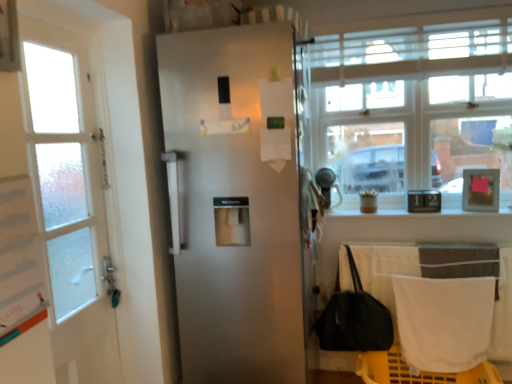
The image size is (512, 384). Describe the element at coordinates (354, 319) in the screenshot. I see `black fabric handbag at lower right` at that location.

What do you see at coordinates (236, 202) in the screenshot?
I see `satin white refrigerator at center` at bounding box center [236, 202].

The image size is (512, 384). Describe the element at coordinates (415, 102) in the screenshot. I see `clear glass window at upper right` at that location.

This screenshot has height=384, width=512. In order to click on white fabric towel at lower right in this screenshot , I will do `click(444, 321)`.

Can you confirm if black fabric handbag at lower right is thinner than satin white refrigerator at center?

Correct, the width of black fabric handbag at lower right is less than that of satin white refrigerator at center.

Between black fabric handbag at lower right and satin white refrigerator at center, which one appears on the left side from the viewer's perspective?

satin white refrigerator at center is more to the left.

From the image's perspective, between black fabric handbag at lower right and satin white refrigerator at center, who is located below?

From the image's view, black fabric handbag at lower right is below.

Between black fabric handbag at lower right and satin white refrigerator at center, which one is positioned in front?

satin white refrigerator at center is in front.

Between clear glass window at upper right and satin white refrigerator at center, which one appears on the left side from the viewer's perspective?

satin white refrigerator at center.

In the scene shown: Which object is wider, clear glass window at upper right or satin white refrigerator at center?

satin white refrigerator at center is wider.

The height and width of the screenshot is (384, 512). I want to click on door in front of the clear glass window at upper right, so click(x=236, y=202).

In the scene shown: Is clear glass window at upper right taller or shorter than satin white refrigerator at center?

Clearly, clear glass window at upper right is shorter compared to satin white refrigerator at center.

Based on the photo, does white fabric towel at lower right contain satin white refrigerator at center?

No.

Is white fabric towel at lower right closer to camera compared to satin white refrigerator at center?

No, it is behind satin white refrigerator at center.

Which is less distant, (482, 281) or (305, 220)?

The point (305, 220) is closer to the camera.

Considering the sizes of objects white fabric towel at lower right and satin white refrigerator at center in the image provided, who is taller, white fabric towel at lower right or satin white refrigerator at center?

satin white refrigerator at center is taller.

At what (x,y) coordinates should I click in order to perform the action: click on blanket that appears on the right of black fabric handbag at lower right. Please return your answer as a coordinate pair (x, y). This screenshot has height=384, width=512. Looking at the image, I should click on (444, 321).

Is black fabric handbag at lower right directly adjacent to white fabric towel at lower right?

They are not placed beside each other.

Between black fabric handbag at lower right and white fabric towel at lower right, which one has smaller size?

With smaller size is black fabric handbag at lower right.

How different are the orientations of black fabric handbag at lower right and white fabric towel at lower right in degrees?

There is a 4.84-degree angle between the facing directions of black fabric handbag at lower right and white fabric towel at lower right.

Is point (404, 320) positioned behind point (335, 340)?

No, (404, 320) is closer to viewer.

From a real-world perspective, is white fabric towel at lower right on top of black fabric handbag at lower right?

No, from a real-world perspective, white fabric towel at lower right is not over black fabric handbag at lower right

Which of these two, white fabric towel at lower right or black fabric handbag at lower right, is bigger?

white fabric towel at lower right.

Are white fabric towel at lower right and black fabric handbag at lower right located far from each other?

No, there isn't a large distance between white fabric towel at lower right and black fabric handbag at lower right.

From the image's perspective, which is below, white fabric towel at lower right or clear glass window at upper right?

white fabric towel at lower right appears lower in the image.

Which is in front, point (428, 366) or point (483, 120)?

The point (428, 366) is in front.

Does white fabric towel at lower right come behind clear glass window at upper right?

No, it is not.

Does white fabric towel at lower right have a lesser height compared to clear glass window at upper right?

Yes, white fabric towel at lower right is shorter than clear glass window at upper right.

Considering the relative positions of satin white refrigerator at center and white fabric towel at lower right in the image provided, is satin white refrigerator at center to the right of white fabric towel at lower right from the viewer's perspective?

No, satin white refrigerator at center is not to the right of white fabric towel at lower right.

From a real-world perspective, which object rests below the other?

white fabric towel at lower right is physically lower.

Considering the sizes of objects satin white refrigerator at center and white fabric towel at lower right in the image provided, who is bigger, satin white refrigerator at center or white fabric towel at lower right?

Bigger between the two is satin white refrigerator at center.

Which is in front, point (248, 37) or point (412, 315)?

The point (248, 37) is more forward.

Find the location of a particular element. The height and width of the screenshot is (384, 512). door on the left of black fabric handbag at lower right is located at coordinates (236, 202).

Where is `door lying below the clear glass window at upper right (from the image's perspective)`? This screenshot has width=512, height=384. door lying below the clear glass window at upper right (from the image's perspective) is located at coordinates (236, 202).

From the image, which object appears to be nearer to satin white refrigerator at center, black fabric handbag at lower right or clear glass window at upper right?

black fabric handbag at lower right.

When comparing their distances from black fabric handbag at lower right, does satin white refrigerator at center or white fabric towel at lower right seem further?

satin white refrigerator at center.

Consider the image. Considering their positions, is black fabric handbag at lower right positioned further to clear glass window at upper right than satin white refrigerator at center?

satin white refrigerator at center lies further to clear glass window at upper right than the other object.

Considering their positions, is black fabric handbag at lower right positioned further to clear glass window at upper right than white fabric towel at lower right?

The object further to clear glass window at upper right is black fabric handbag at lower right.

Which object lies nearer to the anchor point black fabric handbag at lower right, white fabric towel at lower right or satin white refrigerator at center?

The object closer to black fabric handbag at lower right is white fabric towel at lower right.

Based on the photo, estimate the real-world distances between objects in this image. Which object is closer to satin white refrigerator at center, black fabric handbag at lower right or white fabric towel at lower right?

black fabric handbag at lower right.

When comparing their distances from black fabric handbag at lower right, does satin white refrigerator at center or clear glass window at upper right seem closer?

Among the two, satin white refrigerator at center is located nearer to black fabric handbag at lower right.

Which object lies further to the anchor point clear glass window at upper right, satin white refrigerator at center or black fabric handbag at lower right?

satin white refrigerator at center lies further to clear glass window at upper right than the other object.

Identify the location of handbag between satin white refrigerator at center and white fabric towel at lower right from left to right. (354, 319).

Where is `door that lies between clear glass window at upper right and black fabric handbag at lower right from top to bottom`? door that lies between clear glass window at upper right and black fabric handbag at lower right from top to bottom is located at coordinates (236, 202).

Where is `handbag between clear glass window at upper right and white fabric towel at lower right in the up-down direction`? The width and height of the screenshot is (512, 384). handbag between clear glass window at upper right and white fabric towel at lower right in the up-down direction is located at coordinates (354, 319).

You are a GUI agent. You are given a task and a screenshot of the screen. Output one action in this format:
    pyautogui.click(x=<x>, y=<y>)
    Task: Click on the door between clear glass window at upper right and white fabric towel at lower right in the up-down direction
    The image size is (512, 384).
    Given the screenshot: What is the action you would take?
    pyautogui.click(x=236, y=202)